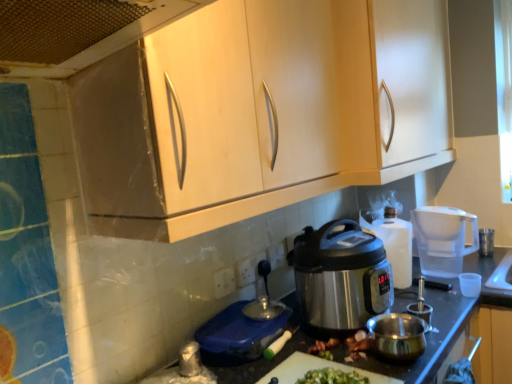
Question: Does white plastic power outlet at center, which appears as the 1th power outlet when viewed from the left, lie in front of white plastic power outlet at center, the third power outlet in the front-to-back sequence?

Choices:
 (A) no
 (B) yes

Answer: (B)

Question: Does white plastic power outlet at center, arranged as the third power outlet when viewed from the back, appear on the left side of white plastic power outlet at center, marked as the 3th power outlet in a left-to-right arrangement?

Choices:
 (A) yes
 (B) no

Answer: (A)

Question: Considering the relative positions of white plastic power outlet at center, which ranks as the 1th power outlet in front-to-back order, and white plastic power outlet at center, marked as the first power outlet in a back-to-front arrangement, in the image provided, is white plastic power outlet at center, which ranks as the 1th power outlet in front-to-back order, behind white plastic power outlet at center, marked as the first power outlet in a back-to-front arrangement,?

Choices:
 (A) yes
 (B) no

Answer: (B)

Question: Can you confirm if white plastic power outlet at center, which appears as the 1th power outlet when viewed from the left, is thinner than white plastic power outlet at center, the third power outlet in the front-to-back sequence?

Choices:
 (A) yes
 (B) no

Answer: (B)

Question: Is white plastic power outlet at center, marked as the first power outlet in a back-to-front arrangement, at the back of white plastic power outlet at center, which ranks as the 1th power outlet in front-to-back order?

Choices:
 (A) yes
 (B) no

Answer: (B)

Question: From the image's perspective, is satin metallic pressure cooker at center, placed as the third appliance when sorted from left to right, above or below satin silver pot at center, arranged as the third appliance when viewed from the back?

Choices:
 (A) below
 (B) above

Answer: (B)

Question: Considering the positions of satin metallic pressure cooker at center, the second appliance from the right, and satin silver pot at center, arranged as the second appliance when viewed from the front, in the image, is satin metallic pressure cooker at center, the second appliance from the right, taller or shorter than satin silver pot at center, arranged as the second appliance when viewed from the front,?

Choices:
 (A) tall
 (B) short

Answer: (A)

Question: Looking at the image, does satin metallic pressure cooker at center, the second appliance from the right, seem bigger or smaller compared to satin silver pot at center, arranged as the second appliance when viewed from the front?

Choices:
 (A) small
 (B) big

Answer: (B)

Question: From a real-world perspective, is satin metallic pressure cooker at center, placed as the third appliance when sorted from left to right, positioned above or below satin silver pot at center, arranged as the third appliance when viewed from the back?

Choices:
 (A) above
 (B) below

Answer: (A)

Question: From the image's perspective, is matte wood cabinet at upper center, the 1th cabinetry when ordered from back to front, above or below white plastic power outlet at center, the second power outlet viewed from the right?

Choices:
 (A) below
 (B) above

Answer: (B)

Question: Is matte wood cabinet at upper center, the 1th cabinetry when ordered from back to front, to the left or to the right of white plastic power outlet at center, the second power outlet viewed from the right, in the image?

Choices:
 (A) left
 (B) right

Answer: (B)

Question: From a real-world perspective, relative to white plastic power outlet at center, the second power outlet positioned from the back, is matte wood cabinet at upper center, the 1th cabinetry when ordered from back to front, vertically above or below?

Choices:
 (A) above
 (B) below

Answer: (A)

Question: Based on their sizes in the image, would you say matte wood cabinet at upper center, positioned as the 2th cabinetry in front-to-back order, is bigger or smaller than white plastic power outlet at center, the second power outlet positioned from the back?

Choices:
 (A) small
 (B) big

Answer: (B)

Question: Is point (365, 152) closer or farther from the camera than point (218, 283)?

Choices:
 (A) closer
 (B) farther

Answer: (B)

Question: From a real-world perspective, is matte wood cabinets at upper center, which is counted as the 2th cabinetry, starting from the back, above or below white plastic power outlet at center, the 3th power outlet from the right?

Choices:
 (A) below
 (B) above

Answer: (B)